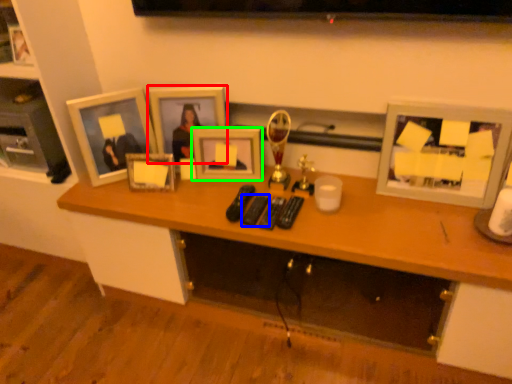
Question: Estimate the real-world distances between objects in this image. Which object is farther from picture frame (highlighted by a red box), remote control (highlighted by a blue box) or picture frame (highlighted by a green box)?

Choices:
 (A) remote control
 (B) picture frame

Answer: (A)